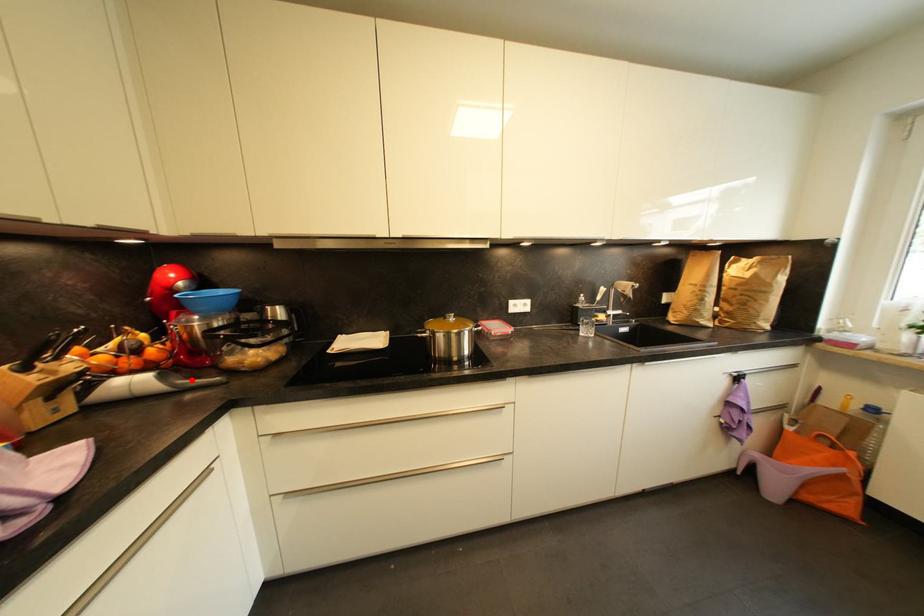
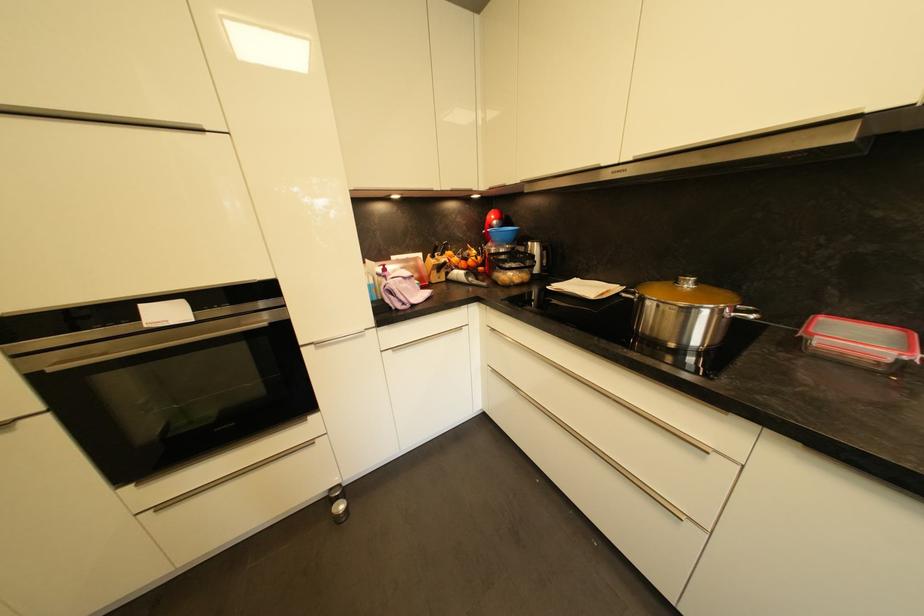
Question: I am providing you with two images of the same scene from different viewpoints. A red point is marked on the first image. Is the red point's position out of view in image 2?

Choices:
 (A) Yes
 (B) No

Answer: (B)